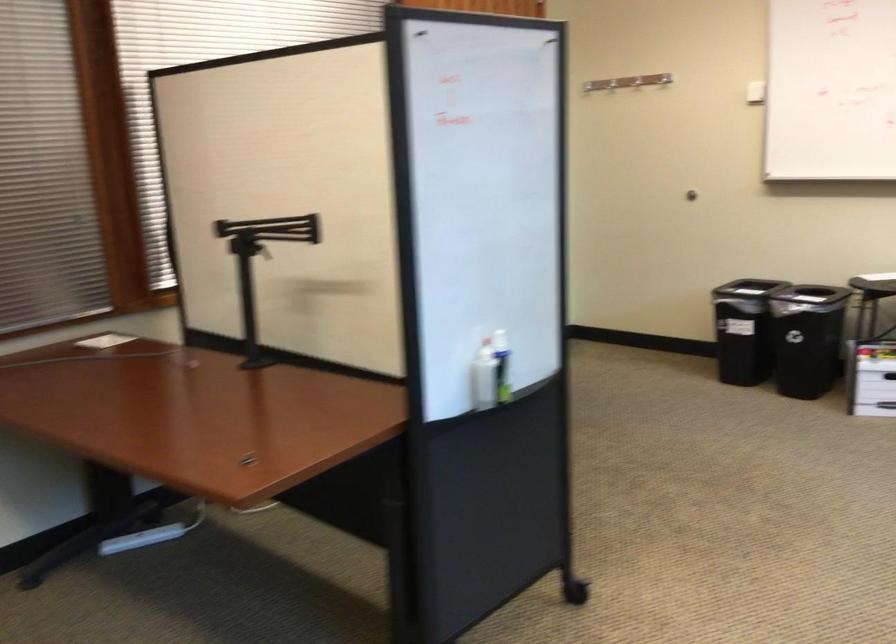
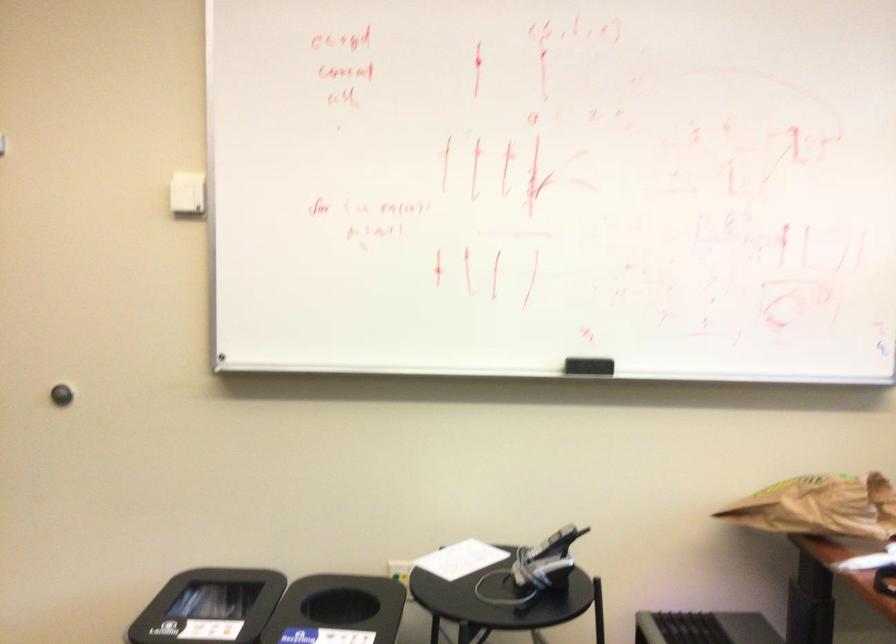
Where in the second image is the point corresponding to the point at 670,91 from the first image?

(186, 194)